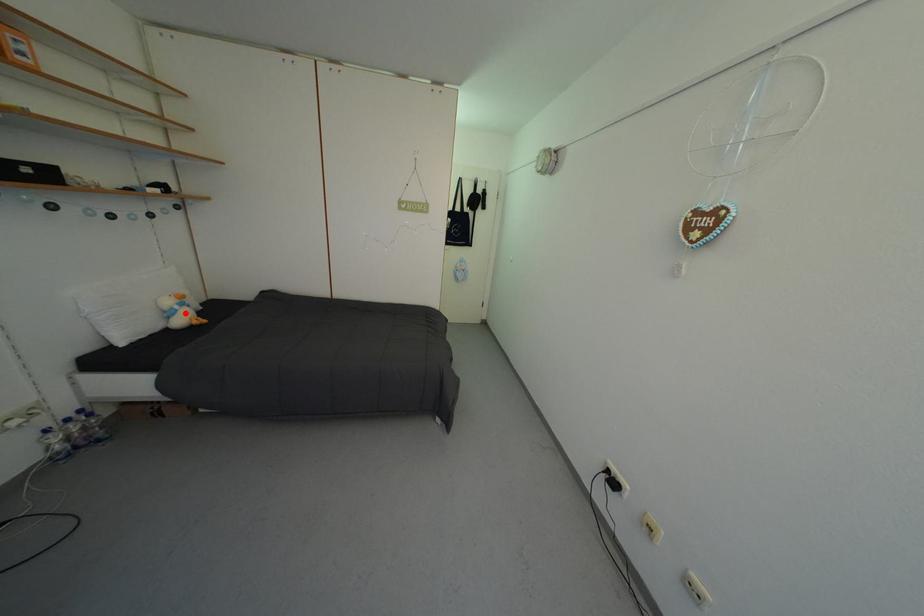
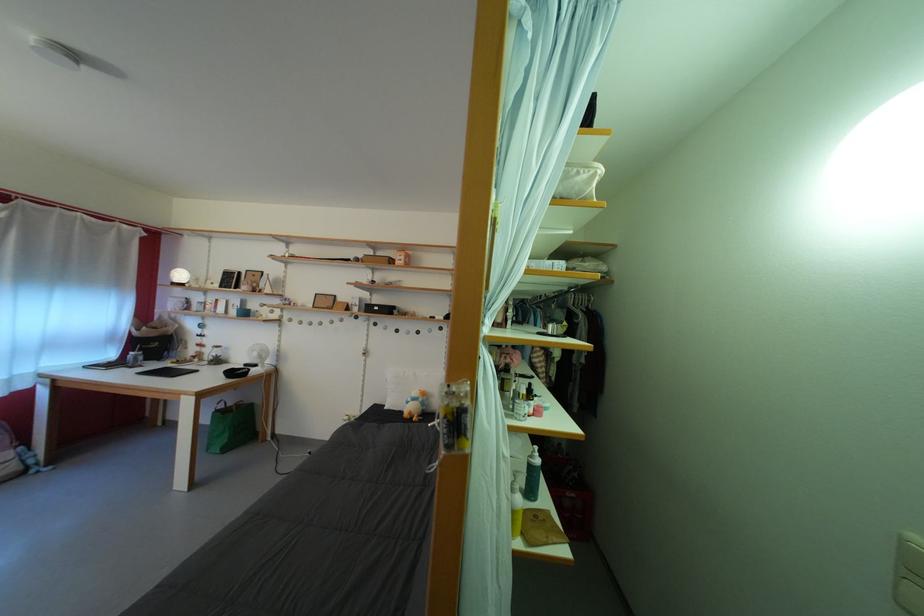
In the second image, find the point that corresponds to the highlighted location in the first image.

(418, 405)